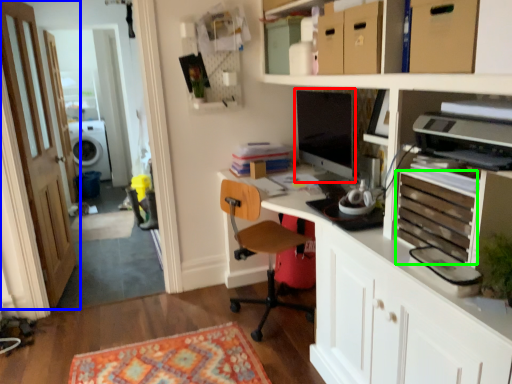
Question: Which object is positioned farthest from computer monitor (highlighted by a red box)? Select from door (highlighted by a blue box) and drawer (highlighted by a green box).

Choices:
 (A) door
 (B) drawer

Answer: (A)